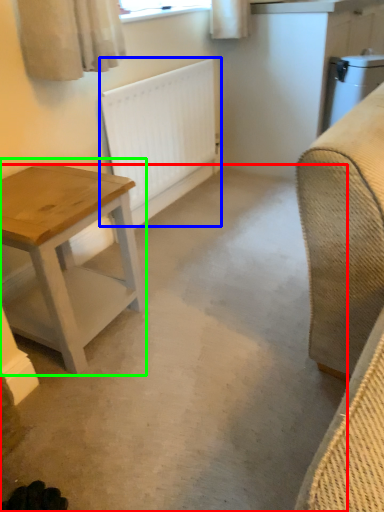
Question: Considering the real-world distances, which object is closest to concrete (highlighted by a red box)? radiator (highlighted by a blue box) or table (highlighted by a green box).

Choices:
 (A) radiator
 (B) table

Answer: (B)